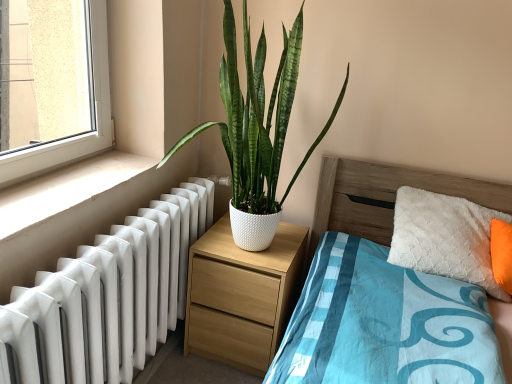
You are a GUI agent. You are given a task and a screenshot of the screen. Output one action in this format:
    pyautogui.click(x=<x>, y=<y>)
    Task: Click on the free point above white smooth window sill at lower left (from a real-world perspective)
    
    Given the screenshot: What is the action you would take?
    pyautogui.click(x=81, y=171)